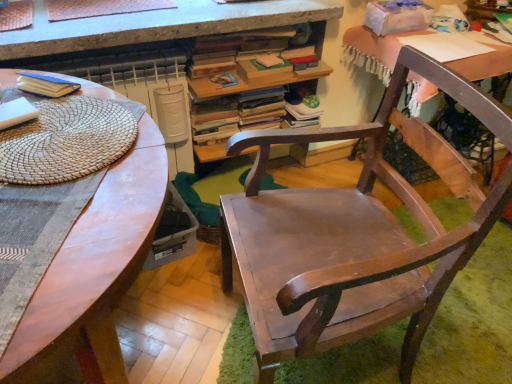
This screenshot has height=384, width=512. In order to click on wooden desk with books at center in this screenshot , I will do `click(262, 77)`.

This screenshot has height=384, width=512. What do you see at coordinates (397, 16) in the screenshot? I see `white paper at upper right` at bounding box center [397, 16].

What do you see at coordinates (253, 60) in the screenshot?
I see `wooden book at upper center` at bounding box center [253, 60].

Measure the distance between wooden chair at center and camera.

A distance of 32.24 inches exists between wooden chair at center and camera.

Identify the location of matte blue paperback book at upper left. coord(46,85).

What do you see at coordinates (46, 85) in the screenshot?
I see `matte blue paperback book at upper left` at bounding box center [46, 85].

At what (x,y) coordinates should I click in order to perform the action: click on wooden desk with books at center. Please return your answer as a coordinate pair (x, y). The height and width of the screenshot is (384, 512). Looking at the image, I should click on (262, 77).

Does wooden desk at upper right, the 1th desk in the right-to-left sequence, have a lesser width compared to white paper at upper right?

In fact, wooden desk at upper right, the 1th desk in the right-to-left sequence, might be wider than white paper at upper right.

Is wooden desk at upper right, which appears as the second desk when viewed from the left, situated inside white paper at upper right or outside?

wooden desk at upper right, which appears as the second desk when viewed from the left, is outside white paper at upper right.

In the image, is wooden desk at upper right, which appears as the second desk when viewed from the left, on the left side or the right side of white paper at upper right?

wooden desk at upper right, which appears as the second desk when viewed from the left, is positioned on white paper at upper right's right side.

Considering the relative sizes of wooden desk at upper right, which appears as the second desk when viewed from the left, and white paper at upper right in the image provided, is wooden desk at upper right, which appears as the second desk when viewed from the left, taller than white paper at upper right?

Yes.

Find the location of a particular element. box that appears above the wooden desk at upper right, which appears as the second desk when viewed from the left (from the image's perspective) is located at coordinates (397, 16).

Between white paper at upper right and wooden desk at upper right, the 1th desk in the right-to-left sequence, which one appears on the right side from the viewer's perspective?

wooden desk at upper right, the 1th desk in the right-to-left sequence.

Does white paper at upper right have a lesser width compared to wooden desk at upper right, which appears as the second desk when viewed from the left?

Correct, the width of white paper at upper right is less than that of wooden desk at upper right, which appears as the second desk when viewed from the left.

Is white paper at upper right facing away from wooden desk at upper right, the 1th desk in the right-to-left sequence?

That's not correct — white paper at upper right is not looking away from wooden desk at upper right, the 1th desk in the right-to-left sequence.

Looking at this image, between wooden desk at upper right, which appears as the second desk when viewed from the left, and matte blue paperback book at upper left, which one has more height?

wooden desk at upper right, which appears as the second desk when viewed from the left.

From a real-world perspective, is wooden desk at upper right, the 1th desk in the right-to-left sequence, positioned above or below matte blue paperback book at upper left?

From a real-world perspective, wooden desk at upper right, the 1th desk in the right-to-left sequence, is physically below matte blue paperback book at upper left.

Is wooden desk at upper right, which appears as the second desk when viewed from the left, wider than matte blue paperback book at upper left?

Yes, wooden desk at upper right, which appears as the second desk when viewed from the left, is wider than matte blue paperback book at upper left.

Who is smaller, wooden desk at upper right, the 1th desk in the right-to-left sequence, or matte blue paperback book at upper left?

matte blue paperback book at upper left is smaller.

Is wooden chair at center smaller than woven beige placemat at left?

Incorrect, wooden chair at center is not smaller in size than woven beige placemat at left.

From their relative heights in the image, would you say wooden chair at center is taller or shorter than woven beige placemat at left?

Clearly, wooden chair at center is taller compared to woven beige placemat at left.

Which is more distant, (x=346, y=227) or (x=74, y=135)?

Point (x=346, y=227)

Visually, is wooden chair at center positioned to the left or to the right of woven beige placemat at left?

In the image, wooden chair at center appears on the right side of woven beige placemat at left.

Consider the image. Considering the sizes of objects white paper at upper right and matte wooden desk at center, which is the 1th desk from left to right, in the image provided, who is wider, white paper at upper right or matte wooden desk at center, which is the 1th desk from left to right,?

With larger width is matte wooden desk at center, which is the 1th desk from left to right.

From a real-world perspective, relative to matte wooden desk at center, which is the 1th desk from left to right, is white paper at upper right vertically above or below?

In terms of real-world spatial position, white paper at upper right is above matte wooden desk at center, which is the 1th desk from left to right.

Is white paper at upper right touching matte wooden desk at center, which is the 2th desk in right-to-left order?

No, white paper at upper right is not with matte wooden desk at center, which is the 2th desk in right-to-left order.

Does white paper at upper right turn towards matte wooden desk at center, which is the 1th desk from left to right?

No, white paper at upper right is not aimed at matte wooden desk at center, which is the 1th desk from left to right.

Between matte wooden desk at center, which is the 1th desk from left to right, and wooden book at upper center, which one has more height?

With more height is matte wooden desk at center, which is the 1th desk from left to right.

Is matte wooden desk at center, which is the 1th desk from left to right, in front of wooden book at upper center?

Yes, it is.

From a real-world perspective, is matte wooden desk at center, which is the 1th desk from left to right, located higher than wooden book at upper center?

No, from a real-world perspective, matte wooden desk at center, which is the 1th desk from left to right, is not over wooden book at upper center

Could you tell me if wooden chair at center is facing white paper at upper right?

No, wooden chair at center does not turn towards white paper at upper right.

Considering the relative positions of wooden chair at center and white paper at upper right in the image provided, is wooden chair at center to the left of white paper at upper right from the viewer's perspective?

Yes, wooden chair at center is to the left of white paper at upper right.

Is white paper at upper right inside wooden chair at center?

No, white paper at upper right is not a part of wooden chair at center.

At what (x,y) coordinates should I click in order to perform the action: click on box located above the wooden desk at upper right, which appears as the second desk when viewed from the left (from a real-world perspective). Please return your answer as a coordinate pair (x, y). The width and height of the screenshot is (512, 384). Looking at the image, I should click on (397, 16).

In order to click on box that appears above the wooden desk at upper right, which appears as the second desk when viewed from the left (from the image's perspective) in this screenshot , I will do pyautogui.click(x=397, y=16).

Estimate the real-world distances between objects in this image. Which object is further from matte wooden desk at center, which is the 2th desk in right-to-left order, wooden book at upper center or wooden desk with books at center?

The object further to matte wooden desk at center, which is the 2th desk in right-to-left order, is wooden desk with books at center.

Looking at the image, which one is located further to wooden desk with books at center, woven beige placemat at left or white paper at upper right?

woven beige placemat at left is further to wooden desk with books at center.

Considering their positions, is woven beige placemat at left positioned further to wooden chair at center than matte blue paperback book at upper left?

Among the two, matte blue paperback book at upper left is located further to wooden chair at center.

When comparing their distances from matte wooden desk at center, which is the 1th desk from left to right, does wooden book at upper center or white paper at upper right seem further?

Among the two, white paper at upper right is located further to matte wooden desk at center, which is the 1th desk from left to right.

Considering their positions, is wooden chair at center positioned further to matte blue paperback book at upper left than wooden desk with books at center?

The object further to matte blue paperback book at upper left is wooden chair at center.

When comparing their distances from wooden book at upper center, does woven beige placemat at left or matte wooden desk at center, which is the 2th desk in right-to-left order, seem further?

matte wooden desk at center, which is the 2th desk in right-to-left order, is positioned further to the anchor wooden book at upper center.

Considering their positions, is white paper at upper right positioned closer to matte blue paperback book at upper left than wooden book at upper center?

Based on the image, wooden book at upper center appears to be nearer to matte blue paperback book at upper left.

When comparing their distances from matte wooden desk at center, which is the 2th desk in right-to-left order, does white paper at upper right or wooden desk with books at center seem further?

Based on the image, white paper at upper right appears to be further to matte wooden desk at center, which is the 2th desk in right-to-left order.

Locate an element on the screen. desk between matte blue paperback book at upper left and wooden desk at upper right, which appears as the second desk when viewed from the left, from left to right is located at coordinates pyautogui.click(x=94, y=272).

Image resolution: width=512 pixels, height=384 pixels. Find the location of `chair between woven beige placemat at left and white paper at upper right in the horizontal direction`. chair between woven beige placemat at left and white paper at upper right in the horizontal direction is located at coordinates (349, 239).

Locate an element on the screen. This screenshot has width=512, height=384. mat between matte wooden desk at center, which is the 1th desk from left to right, and wooden desk at upper right, which appears as the second desk when viewed from the left, in the horizontal direction is located at coordinates (68, 140).

Find the location of a particular element. Image resolution: width=512 pixels, height=384 pixels. mat between matte blue paperback book at upper left and wooden desk at upper right, which appears as the second desk when viewed from the left is located at coordinates (68, 140).